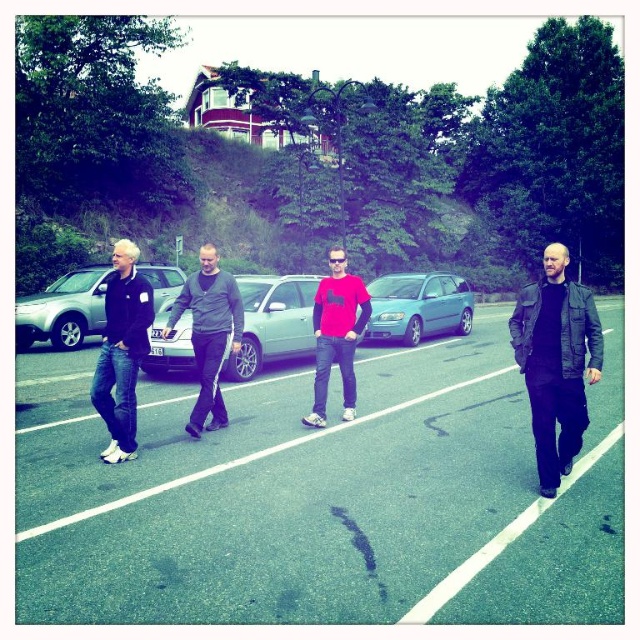
Which is below, dark blue jeans at left or matte red t-shirt at center?

matte red t-shirt at center is lower down.

Looking at this image, who is more distant from viewer, (132,442) or (348,324)?

The point (348,324) is behind.

Where is `dark blue jeans at left`? dark blue jeans at left is located at coordinates pos(122,349).

Can you confirm if green asphalt parking lot at center is positioned below dark blue jeans at left?

Yes.

Is point (292, 576) behind point (138, 252)?

No, (292, 576) is closer to viewer.

Where is `green asphalt parking lot at center`? The height and width of the screenshot is (640, 640). green asphalt parking lot at center is located at coordinates (294, 502).

Does green asphalt parking lot at center lie behind leather jacket at right?

No, it is not.

Can you confirm if green asphalt parking lot at center is taller than leather jacket at right?

In fact, green asphalt parking lot at center may be shorter than leather jacket at right.

What do you see at coordinates (294, 502) in the screenshot? I see `green asphalt parking lot at center` at bounding box center [294, 502].

This screenshot has height=640, width=640. In order to click on green asphalt parking lot at center in this screenshot , I will do `click(294, 502)`.